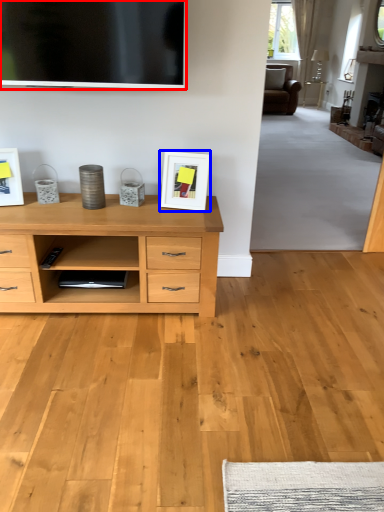
Question: Among these objects, which one is farthest to the camera, television (highlighted by a red box) or picture frame (highlighted by a blue box)?

Choices:
 (A) television
 (B) picture frame

Answer: (B)